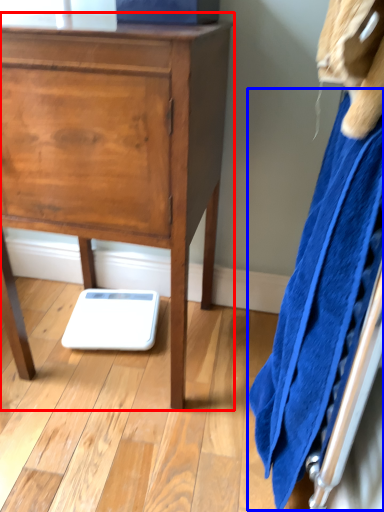
Question: Which point is closer to the camera, chest of drawers (highlighted by a red box) or bath towel (highlighted by a blue box)?

Choices:
 (A) chest of drawers
 (B) bath towel

Answer: (B)